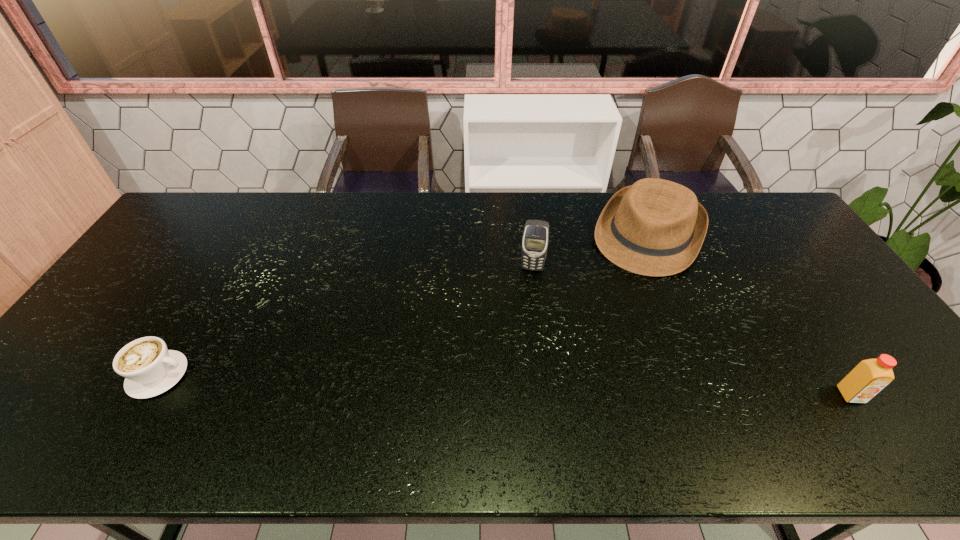
In order to click on the shortest object in this screenshot , I will do `click(149, 368)`.

This screenshot has width=960, height=540. Identify the location of the leftmost object. (149, 368).

I want to click on the rightmost object, so click(x=870, y=376).

You are a GUI agent. You are given a task and a screenshot of the screen. Output one action in this format:
    pyautogui.click(x=<x>, y=<y>)
    Task: Click on the cellular telephone
    
    Given the screenshot: What is the action you would take?
    pyautogui.click(x=535, y=239)

This screenshot has width=960, height=540. In order to click on the third object from right to left in this screenshot , I will do `click(535, 239)`.

At what (x,y) coordinates should I click in order to perform the action: click on the second object from right to left. Please return your answer as a coordinate pair (x, y). Looking at the image, I should click on (655, 227).

Locate an element on the screen. This screenshot has width=960, height=540. vacant space positioned 0.110m to the right of the shortest object's handle is located at coordinates (233, 375).

Image resolution: width=960 pixels, height=540 pixels. Find the location of `free space located on the front face of the tallest object`. free space located on the front face of the tallest object is located at coordinates (524, 332).

What are the coordinates of `free region located 0.110m on the front face of the tallest object` in the screenshot? It's located at (528, 299).

Identify the location of vacant space situated 0.050m on the front face of the tallest object. Image resolution: width=960 pixels, height=540 pixels. (529, 285).